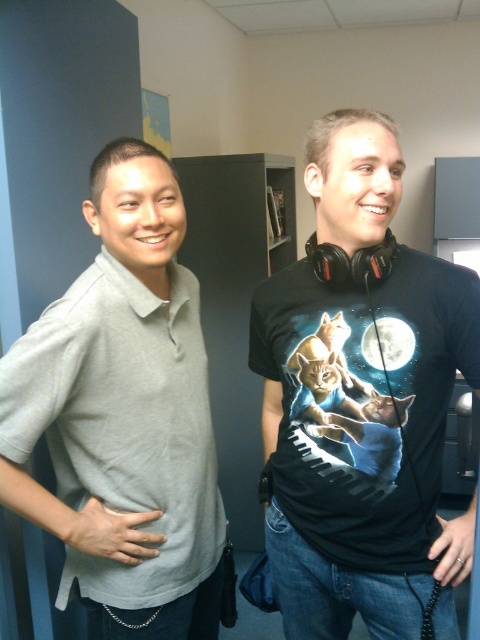
Question: Is black matte t-shirt at center positioned before light gray cotton polo shirt at left?

Choices:
 (A) no
 (B) yes

Answer: (B)

Question: Among these objects, which one is nearest to the camera?

Choices:
 (A) light gray cotton polo shirt at left
 (B) black matte t-shirt at center

Answer: (B)

Question: Does black matte t-shirt at center have a lesser width compared to light gray cotton polo shirt at left?

Choices:
 (A) yes
 (B) no

Answer: (B)

Question: Is black matte t-shirt at center smaller than light gray cotton polo shirt at left?

Choices:
 (A) no
 (B) yes

Answer: (A)